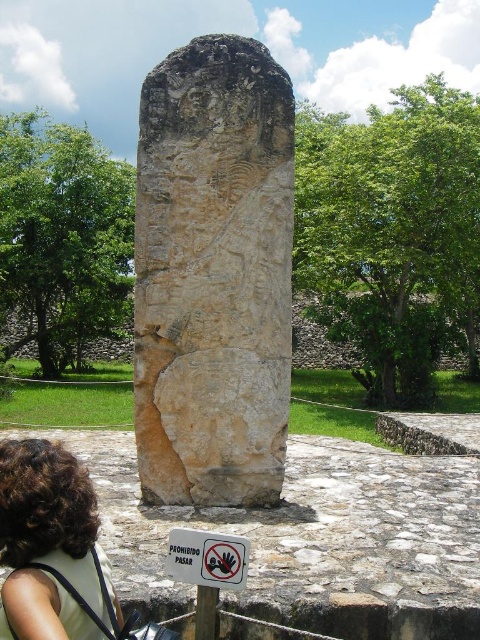
Can you confirm if carved stone monument at center is thinner than brown stone pillar at center?

Incorrect, carved stone monument at center's width is not less than brown stone pillar at center's.

Which is behind, point (271, 394) or point (212, 588)?

Point (271, 394)

At what (x,y) coordinates should I click in order to perform the action: click on carved stone monument at center. Please return your answer as a coordinate pair (x, y). The height and width of the screenshot is (640, 480). Looking at the image, I should click on (213, 275).

Does brown curly hair at lower left lie in front of brown stone pillar at center?

That is True.

Is brown curly hair at lower left wider than brown stone pillar at center?

Yes, brown curly hair at lower left is wider than brown stone pillar at center.

Where is `brown curly hair at lower left`? brown curly hair at lower left is located at coordinates (47, 541).

Measure the distance from carved stone monument at center to brown curly hair at lower left.

carved stone monument at center and brown curly hair at lower left are 8.68 feet apart from each other.

This screenshot has width=480, height=640. In order to click on carved stone monument at center in this screenshot , I will do `click(213, 275)`.

Between point (245, 380) and point (85, 493), which one is positioned in front?

Positioned in front is point (85, 493).

Locate an element on the screen. carved stone monument at center is located at coordinates [213, 275].